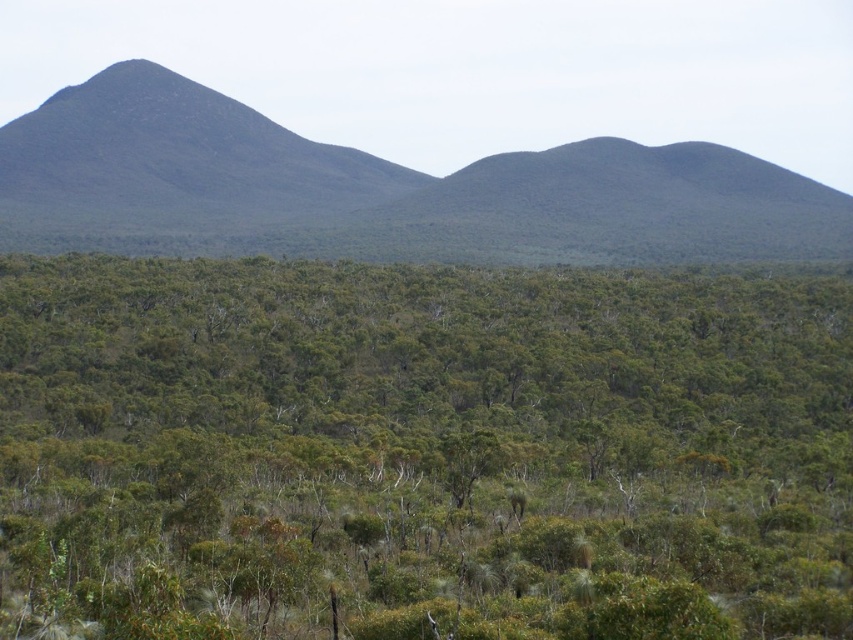
You are a hiker trying to navigate through the forest. You see a green leafy shrub at center and a dark green textured mountain at left. Which object is narrower in width?

The green leafy shrub at center has a lesser width compared to the dark green textured mountain at left, so the green leafy shrub at center is narrower.

Looking at this image, what are the coordinates of the green leafy shrub at center?

The green leafy shrub at center is located at coordinates point (x=421, y=451).

You are an explorer trying to navigate between the dark green textured mountain at left and the dark brown rocky mountain at left. Which mountain should you head towards if you want to move towards the right side of the image?

You should head towards the dark green textured mountain at left because it is positioned to the right of the dark brown rocky mountain at left, so moving towards it would align with the right direction in the image.